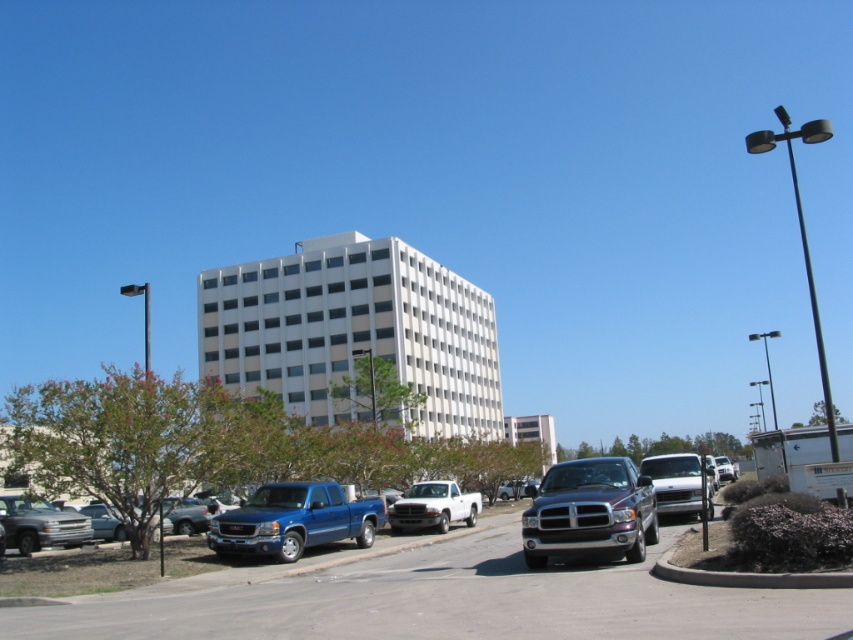
Question: Does silver metallic truck at lower left appear under white matte truck at center?

Choices:
 (A) yes
 (B) no

Answer: (B)

Question: Can you confirm if metallic blue truck at center is smaller than silver metallic truck at lower left?

Choices:
 (A) no
 (B) yes

Answer: (A)

Question: Which object is positioned closest to the satin dark gray pickup truck at center?

Choices:
 (A) silver metallic van at center-right
 (B) blue metallic pickup truck at center
 (C) white matte trailer at lower right

Answer: (A)

Question: Is blue metallic pickup truck at center thinner than white matte truck at center?

Choices:
 (A) no
 (B) yes

Answer: (A)

Question: Which point is closer to the camera?

Choices:
 (A) white matte truck at center
 (B) silver metallic van at center-right
 (C) satin dark gray pickup truck at center

Answer: (C)

Question: Which point is closer to the camera?

Choices:
 (A) (805, 589)
 (B) (799, 474)
 (C) (24, 554)

Answer: (A)